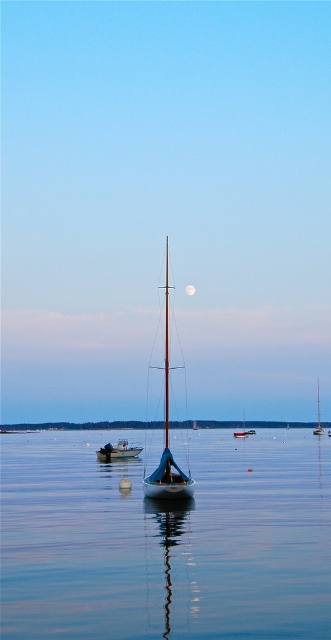
You are standing on the deck of the sailboat and looking out at two points in the water. You want to know which point is closer to you. The points are labeled as point 1 at coordinates point (42,426) and point 2 at coordinates point (190,292). Which point is closer to your current position on the boat?

Point 2 at coordinates point (190,292) is closer to your current position on the boat because point 1 at coordinates point (42,426) is behind it.